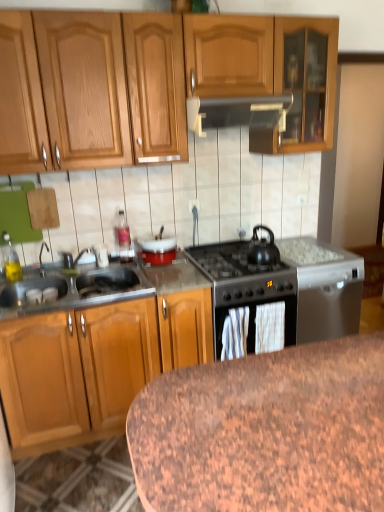
Where is `vacant point above granite table at lower center (from a real-world perspective)`? vacant point above granite table at lower center (from a real-world perspective) is located at coordinates (281, 406).